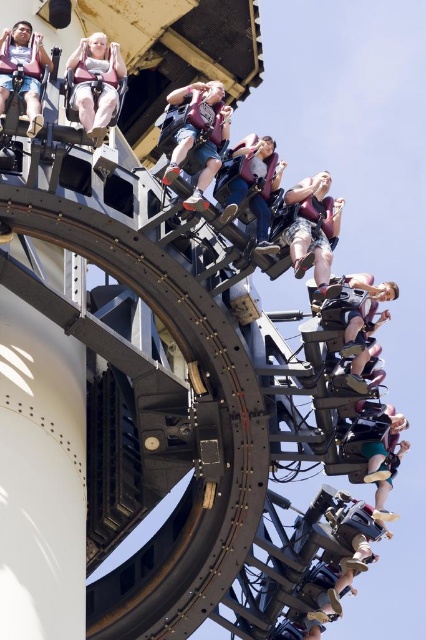
You are a photographer trying to capture a clear photo of the matte black shirt at center and the matte black shorts at center of the roller coaster rider. Since both are dark, you want to ensure they are distinguishable. Which object should you focus on first to ensure it appears clearly in your photo?

The matte black shirt at center is positioned under the matte black shorts at center, so you should focus on the matte black shirt at center first to ensure it appears clearly in your photo.

You are a safety inspector checking the roller coaster. You notice two items at the center of the scene labeled as the matte black helmet at center and the matte black shorts at center. Which item is closer to the ground?

The matte black shorts at center are closer to the ground since the matte black helmet at center is shorter than it.